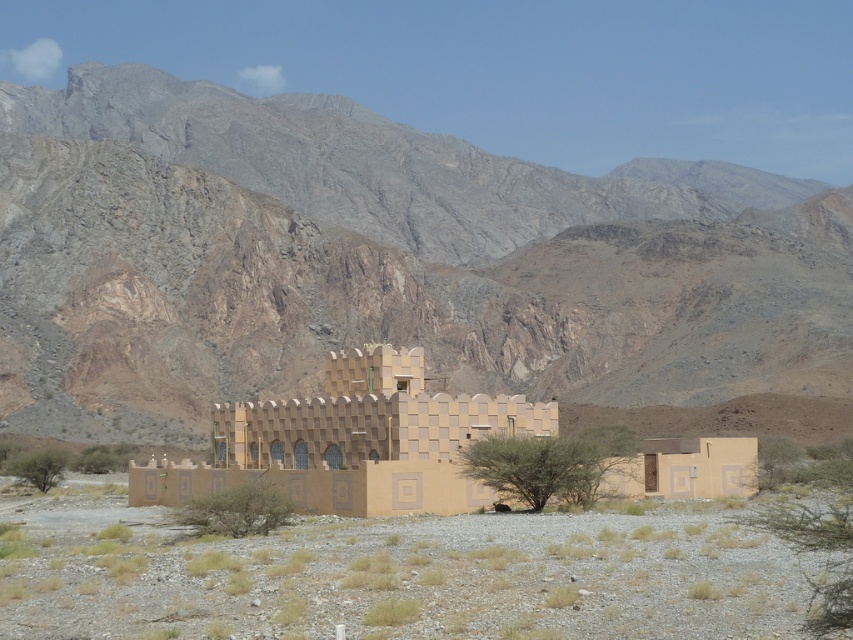
You are standing in front of the beige textured fort at center and want to take a photo of the brown rocky mountain range at upper center. Which direction should you turn to face the mountain range?

The brown rocky mountain range at upper center is to the left of the beige textured fort at center, so you should turn to your left to face the mountain range.

You are planning to build a small garden near the beige textured fort at center. Considering the brown rocky mountain range at upper center, which object is taller and could potentially block sunlight? Please name the object.

The brown rocky mountain range at upper center is much taller than the beige textured fort at center and could block sunlight.